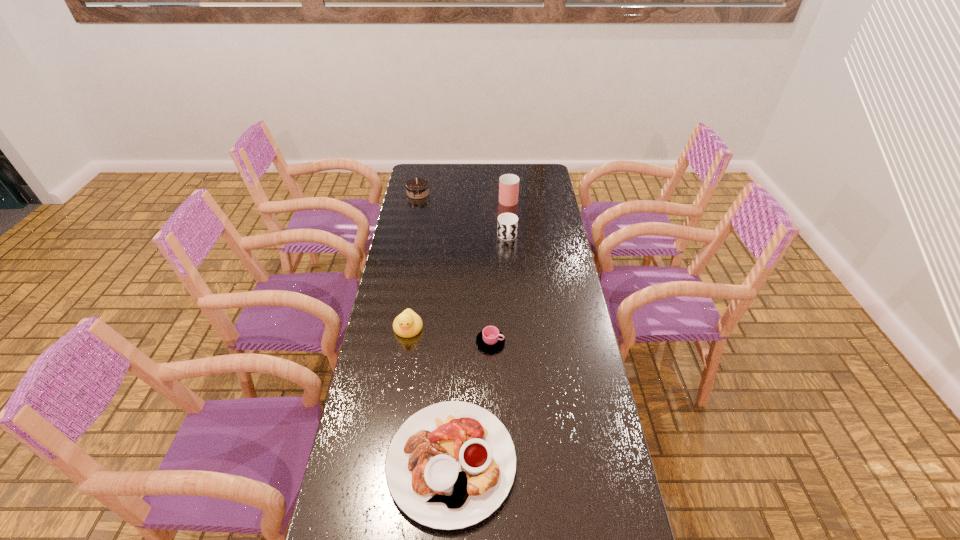
Find the location of `free spot between the platter and the second farthest cup`. free spot between the platter and the second farthest cup is located at coordinates (479, 349).

Where is `vacant area that lies between the second shortest cup and the chocolate cake`? Image resolution: width=960 pixels, height=540 pixels. vacant area that lies between the second shortest cup and the chocolate cake is located at coordinates (463, 215).

Locate an element on the screen. The height and width of the screenshot is (540, 960). free space that is in between the farthest cup and the platter is located at coordinates (x=480, y=330).

Locate which object is the second closest to the farthest cup. Please provide its 2D coordinates. Your answer should be formatted as a tuple, i.e. [(x, y)], where the tuple contains the x and y coordinates of a point satisfying the conditions above.

[(417, 188)]

Choose which object is the fourth nearest neighbor to the nearest object. Please provide its 2D coordinates. Your answer should be formatted as a tuple, i.e. [(x, y)], where the tuple contains the x and y coordinates of a point satisfying the conditions above.

[(508, 184)]

Select which cup appears as the second closest to the farthest cup. Please provide its 2D coordinates. Your answer should be formatted as a tuple, i.e. [(x, y)], where the tuple contains the x and y coordinates of a point satisfying the conditions above.

[(490, 338)]

Identify which cup is the third nearest to the chocolate cake. Please provide its 2D coordinates. Your answer should be formatted as a tuple, i.e. [(x, y)], where the tuple contains the x and y coordinates of a point satisfying the conditions above.

[(490, 338)]

At what (x,y) coordinates should I click in order to perform the action: click on free space that satisfies the following two spatial constraints: 1. on the side of the second farthest cup with the handle; 2. on the side with the handle of the nearest cup. Please return your answer as a coordinate pair (x, y). This screenshot has height=540, width=960. Looking at the image, I should click on (515, 342).

Where is `vacant space that satisfies the following two spatial constraints: 1. on the face of the duckling; 2. on the left side of the nearest object`? This screenshot has height=540, width=960. vacant space that satisfies the following two spatial constraints: 1. on the face of the duckling; 2. on the left side of the nearest object is located at coordinates (388, 462).